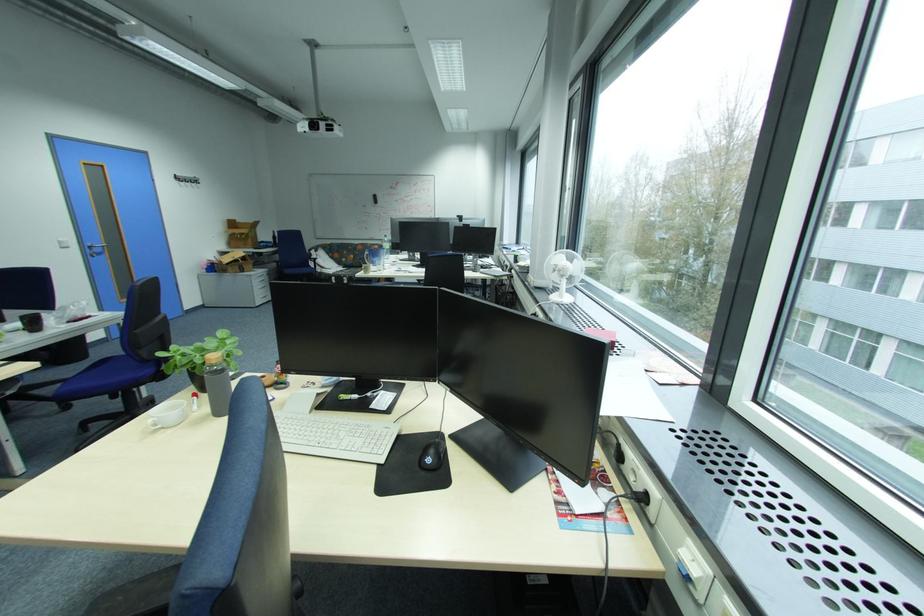
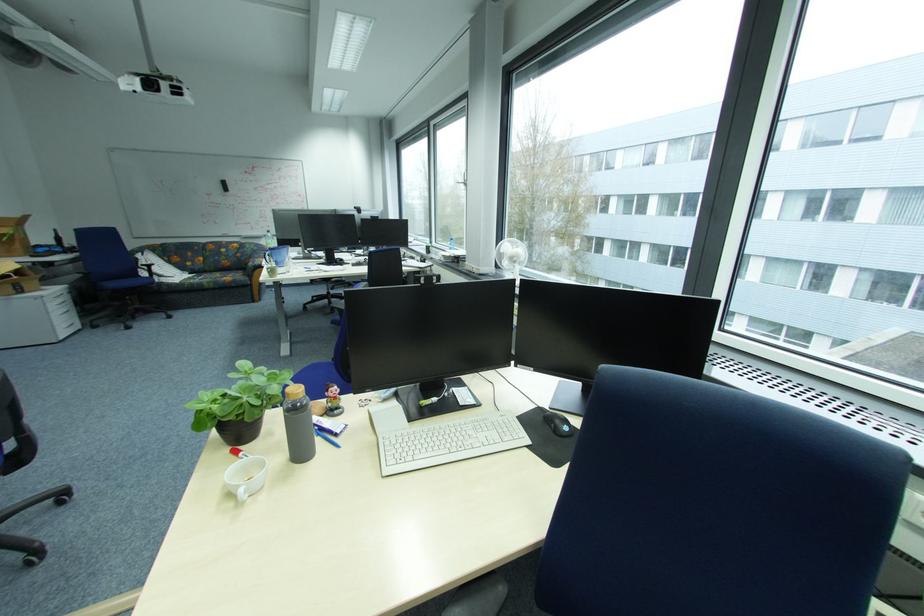
Locate, in the second image, the point that corresponds to (x=569, y=274) in the first image.

(524, 259)